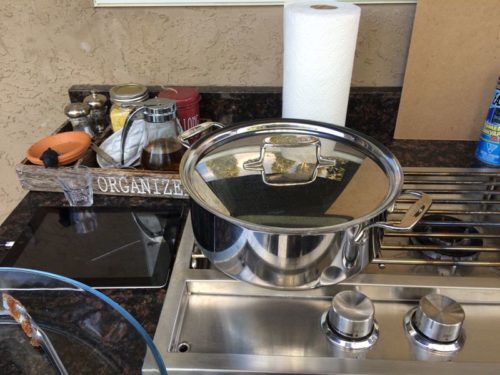
The width and height of the screenshot is (500, 375). I want to click on shot glass, so click(80, 194).